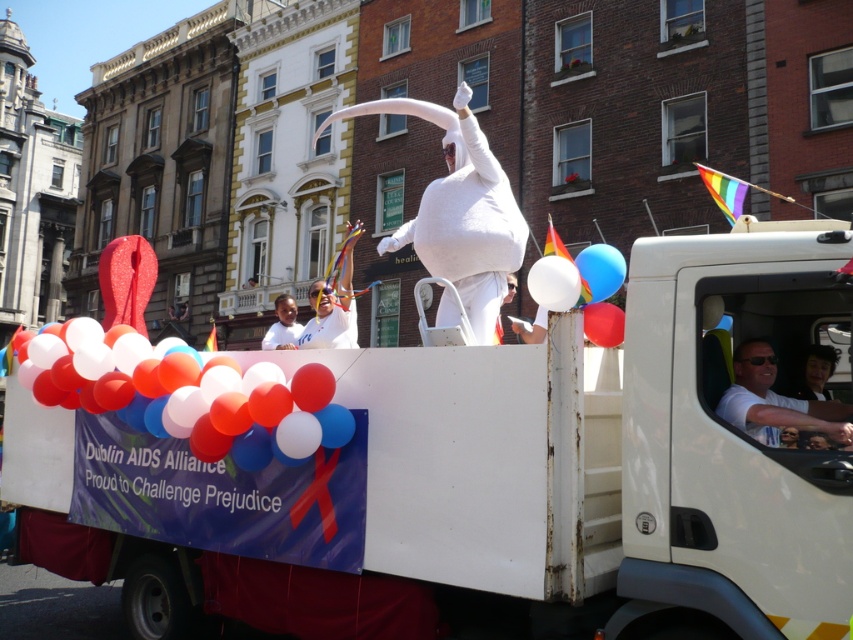
Question: Does white matte balloon at upper center have a smaller size compared to smooth black hair at upper right?

Choices:
 (A) yes
 (B) no

Answer: (B)

Question: Does white matte truck at center have a greater width compared to smooth black hair at upper right?

Choices:
 (A) yes
 (B) no

Answer: (A)

Question: Which object is farther from the camera taking this photo?

Choices:
 (A) blue glossy balloon at upper right
 (B) white matte truck at center

Answer: (A)

Question: Observing the image, what is the correct spatial positioning of white matte balloon at upper center in reference to white matte balloon at center?

Choices:
 (A) left
 (B) right

Answer: (B)

Question: Considering the real-world distances, which object is farthest from the smooth black hair at upper right?

Choices:
 (A) white fluffy costume at center
 (B) blue glossy balloon at upper right
 (C) white matte truck driver at center
 (D) white matte balloon at upper center

Answer: (A)

Question: Which of the following is the closest to the observer?

Choices:
 (A) (805, 372)
 (B) (599, 275)

Answer: (B)